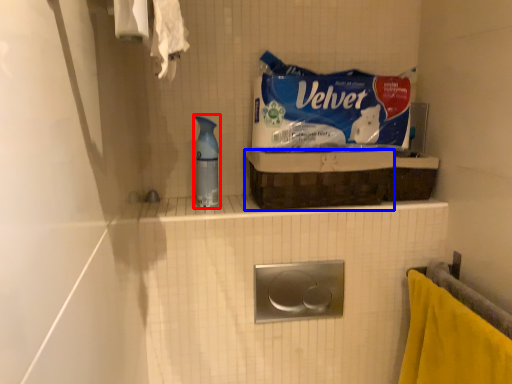
Question: Which object is further to the camera taking this photo, cleaning product (highlighted by a red box) or basket (highlighted by a blue box)?

Choices:
 (A) cleaning product
 (B) basket

Answer: (A)